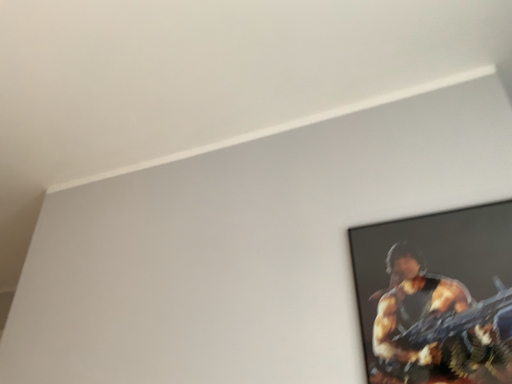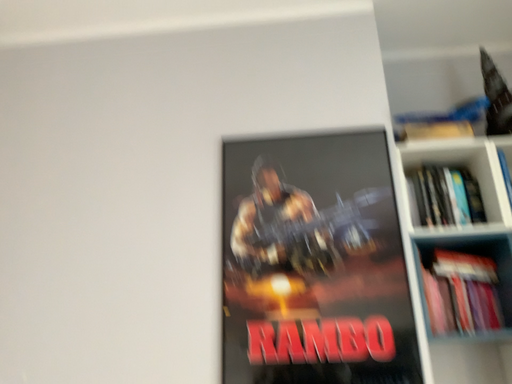
Question: How did the camera likely rotate when shooting the video?

Choices:
 (A) rotated downward
 (B) rotated upward

Answer: (A)